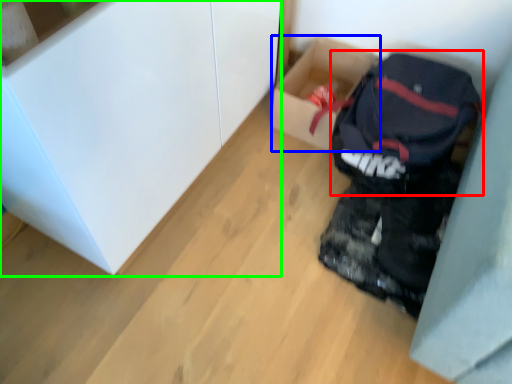
Question: Based on their relative distances, which object is nearer to backpack (highlighted by a red box)? Choose from box (highlighted by a blue box) and cabinetry (highlighted by a green box).

Choices:
 (A) box
 (B) cabinetry

Answer: (A)